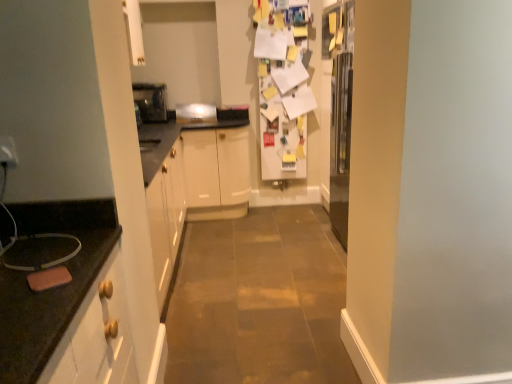
Question: Can you confirm if metallic silver toaster at center, acting as the 1th appliance starting from the left, is taller than satin silver toaster at center, marked as the first appliance in a right-to-left arrangement?

Choices:
 (A) yes
 (B) no

Answer: (A)

Question: Is metallic silver toaster at center, positioned as the 2th appliance in right-to-left order, outside satin silver toaster at center, marked as the first appliance in a right-to-left arrangement?

Choices:
 (A) yes
 (B) no

Answer: (A)

Question: From the image's perspective, would you say metallic silver toaster at center, positioned as the 2th appliance in right-to-left order, is positioned over satin silver toaster at center, marked as the first appliance in a right-to-left arrangement?

Choices:
 (A) yes
 (B) no

Answer: (A)

Question: Does metallic silver toaster at center, positioned as the 2th appliance in right-to-left order, have a greater width compared to satin silver toaster at center, the 2th appliance from the left?

Choices:
 (A) no
 (B) yes

Answer: (B)

Question: From a real-world perspective, is metallic silver toaster at center, positioned as the 2th appliance in right-to-left order, below satin silver toaster at center, marked as the first appliance in a right-to-left arrangement?

Choices:
 (A) no
 (B) yes

Answer: (A)

Question: Does metallic silver toaster at center, acting as the 1th appliance starting from the left, have a lesser width compared to satin silver toaster at center, the 2th appliance from the left?

Choices:
 (A) yes
 (B) no

Answer: (B)

Question: Is satin silver toaster at center, marked as the first appliance in a right-to-left arrangement, outside metallic silver toaster at center, positioned as the 2th appliance in right-to-left order?

Choices:
 (A) yes
 (B) no

Answer: (A)

Question: Can you confirm if satin silver toaster at center, the 2th appliance from the left, is shorter than metallic silver toaster at center, positioned as the 2th appliance in right-to-left order?

Choices:
 (A) no
 (B) yes

Answer: (B)

Question: Does satin silver toaster at center, marked as the first appliance in a right-to-left arrangement, have a lesser width compared to metallic silver toaster at center, positioned as the 2th appliance in right-to-left order?

Choices:
 (A) no
 (B) yes

Answer: (B)

Question: Is satin silver toaster at center, marked as the first appliance in a right-to-left arrangement, wider than metallic silver toaster at center, positioned as the 2th appliance in right-to-left order?

Choices:
 (A) no
 (B) yes

Answer: (A)

Question: From the image's perspective, is satin silver toaster at center, the 2th appliance from the left, above metallic silver toaster at center, positioned as the 2th appliance in right-to-left order?

Choices:
 (A) yes
 (B) no

Answer: (B)

Question: From a real-world perspective, is satin silver toaster at center, marked as the first appliance in a right-to-left arrangement, beneath metallic silver toaster at center, acting as the 1th appliance starting from the left?

Choices:
 (A) no
 (B) yes

Answer: (B)

Question: From their relative heights in the image, would you say metallic silver toaster at center, acting as the 1th appliance starting from the left, is taller or shorter than satin silver toaster at center, the 2th appliance from the left?

Choices:
 (A) short
 (B) tall

Answer: (B)